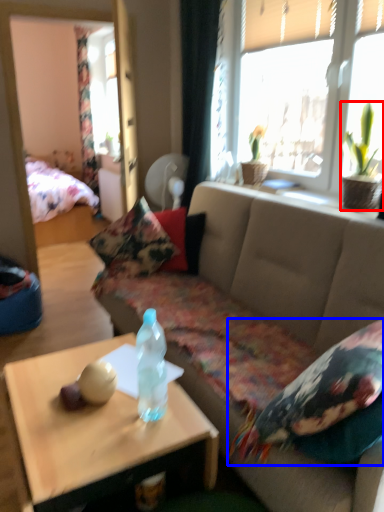
Question: Which object appears closest to the camera in this image, houseplant (highlighted by a red box) or pillow (highlighted by a blue box)?

Choices:
 (A) houseplant
 (B) pillow

Answer: (B)